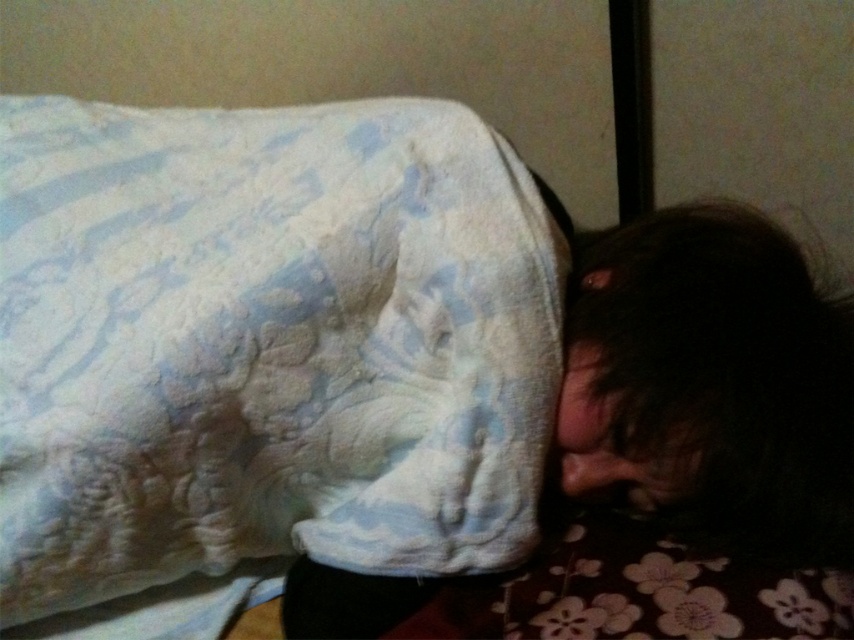
Does fluffy white blanket at upper left have a greater height compared to dark matte hair at lower right?

Yes, fluffy white blanket at upper left is taller than dark matte hair at lower right.

Between point (313, 198) and point (589, 484), which one is positioned in front?

Point (313, 198)

Describe the element at coordinates (266, 342) in the screenshot. I see `fluffy white blanket at upper left` at that location.

Locate an element on the screen. fluffy white blanket at upper left is located at coordinates (266, 342).

Who is more forward, (816,374) or (578,493)?

Positioned in front is point (816,374).

Is point (583, 385) in front of point (623, 456)?

No, it is behind (623, 456).

Who is more distant from viewer, (852, 545) or (626, 484)?

The point (626, 484) is behind.

I want to click on dark hair at lower right, so click(717, 374).

In the scene shown: Can you confirm if fluffy white blanket at upper left is thinner than dark hair at lower right?

No.

Is fluffy white blanket at upper left to the right of dark hair at lower right from the viewer's perspective?

Incorrect, fluffy white blanket at upper left is not on the right side of dark hair at lower right.

Does point (469, 324) come behind point (747, 500)?

No, (469, 324) is closer to viewer.

Identify the location of fluffy white blanket at upper left. (266, 342).